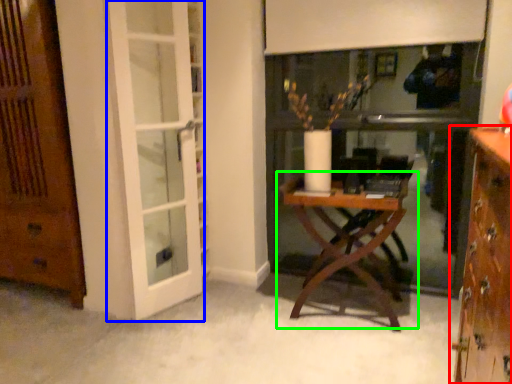
Question: Based on their relative distances, which object is farther from cabinetry (highlighted by a red box)? Choose from screen door (highlighted by a blue box) and table (highlighted by a green box).

Choices:
 (A) screen door
 (B) table

Answer: (A)